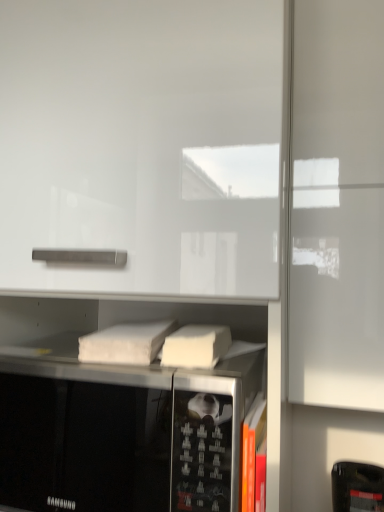
Image resolution: width=384 pixels, height=512 pixels. Find the location of `black matte microwave oven at center`. black matte microwave oven at center is located at coordinates (84, 438).

Who is smaller, black matte microwave oven at center or white matte book at center, marked as the 1th book in a back-to-front arrangement?

white matte book at center, marked as the 1th book in a back-to-front arrangement.

From a real-world perspective, does black matte microwave oven at center stand above white matte book at center, which is counted as the 1th book, starting from the left?

No, from a real-world perspective, black matte microwave oven at center is not over white matte book at center, which is counted as the 1th book, starting from the left

Which object is more forward, black matte microwave oven at center or white matte book at center, the second book from the bottom?

Positioned in front is black matte microwave oven at center.

From the image's perspective, between black matte microwave oven at center and white matte book at center, arranged as the 1th book when viewed from the top, which one is located above?

white matte book at center, arranged as the 1th book when viewed from the top, is shown above in the image.

Are black matte microwave oven at center and orange matte book at lower right, which ranks as the first book in right-to-left order, beside each other?

No, black matte microwave oven at center is not next to orange matte book at lower right, which ranks as the first book in right-to-left order.

Does black matte microwave oven at center contain orange matte book at lower right, the first book in the bottom-to-top sequence?

No, orange matte book at lower right, the first book in the bottom-to-top sequence, is not surrounded by black matte microwave oven at center.

Is black matte microwave oven at center positioned with its back to orange matte book at lower right, which ranks as the first book in right-to-left order?

No, black matte microwave oven at center is not facing away from orange matte book at lower right, which ranks as the first book in right-to-left order.

Considering the positions of objects black matte microwave oven at center and orange matte book at lower right, which ranks as the first book in right-to-left order, in the image provided, who is in front, black matte microwave oven at center or orange matte book at lower right, which ranks as the first book in right-to-left order,?

black matte microwave oven at center is more forward.

Which of these two, white matte book at center, marked as the 1th book in a back-to-front arrangement, or black matte microwave oven at center, is thinner?

Thinner between the two is white matte book at center, marked as the 1th book in a back-to-front arrangement.

Would you say white matte book at center, the second book from the bottom, is inside or outside black matte microwave oven at center?

white matte book at center, the second book from the bottom, lies outside black matte microwave oven at center.

Does white matte book at center, arranged as the 1th book when viewed from the top, have a greater height compared to black matte microwave oven at center?

In fact, white matte book at center, arranged as the 1th book when viewed from the top, may be shorter than black matte microwave oven at center.

Who is bigger, white matte book at center, which is the 2th book from right to left, or black matte microwave oven at center?

Bigger between the two is black matte microwave oven at center.

Is orange matte book at lower right, which is the 1th book from front to back, with black matte microwave oven at center?

No, orange matte book at lower right, which is the 1th book from front to back, is not in contact with black matte microwave oven at center.

Locate an element on the screen. book below the black matte microwave oven at center (from the image's perspective) is located at coordinates (252, 449).

Consider the image. Does orange matte book at lower right, which ranks as the first book in right-to-left order, have a larger size compared to black matte microwave oven at center?

No.

Can you confirm if white matte book at center, which is the 2th book from right to left, is bigger than orange matte book at lower right, which is the second book in back-to-front order?

Correct, white matte book at center, which is the 2th book from right to left, is larger in size than orange matte book at lower right, which is the second book in back-to-front order.

From the image's perspective, which is below, white matte book at center, marked as the 1th book in a back-to-front arrangement, or orange matte book at lower right, the first book in the bottom-to-top sequence?

orange matte book at lower right, the first book in the bottom-to-top sequence, from the image's perspective.

Are white matte book at center, which is counted as the 1th book, starting from the left, and orange matte book at lower right, which is the second book in back-to-front order, far apart?

Actually, white matte book at center, which is counted as the 1th book, starting from the left, and orange matte book at lower right, which is the second book in back-to-front order, are a little close together.

From the picture: Can orange matte book at lower right, placed as the 2th book when sorted from top to bottom, be found inside white matte book at center, the second book from the bottom?

No, orange matte book at lower right, placed as the 2th book when sorted from top to bottom, is located outside of white matte book at center, the second book from the bottom.

Between orange matte book at lower right, which is the second book in back-to-front order, and white matte book at center, which is the 2th book from right to left, which one has more height?

orange matte book at lower right, which is the second book in back-to-front order.

Does orange matte book at lower right, which is the 1th book from front to back, have a greater width compared to white matte book at center, the second book from the bottom?

Incorrect, the width of orange matte book at lower right, which is the 1th book from front to back, does not surpass that of white matte book at center, the second book from the bottom.

In the image, there is a white matte book at center, the second book from the bottom. What are the coordinates of `book below it (from a real-world perspective)` in the screenshot? It's located at (252, 449).

Looking at this image, is orange matte book at lower right, which is the second book in back-to-front order, next to white matte book at center, the second book from the front, and touching it?

No, orange matte book at lower right, which is the second book in back-to-front order, is not next to white matte book at center, the second book from the front.

Find the location of `book positioned vertically above the black matte microwave oven at center (from a real-world perspective)`. book positioned vertically above the black matte microwave oven at center (from a real-world perspective) is located at coordinates (125, 343).

Locate an element on the screen. microwave oven located in front of the orange matte book at lower right, which is the 1th book from front to back is located at coordinates (84, 438).

Looking at the image, which one is located closer to black matte microwave oven at center, white matte book at center, marked as the 1th book in a back-to-front arrangement, or orange matte book at lower right, which ranks as the first book in right-to-left order?

white matte book at center, marked as the 1th book in a back-to-front arrangement, lies closer to black matte microwave oven at center than the other object.

Looking at the image, which one is located further to orange matte book at lower right, which is the 1th book from front to back, white matte book at center, marked as the 1th book in a back-to-front arrangement, or black matte microwave oven at center?

Among the two, white matte book at center, marked as the 1th book in a back-to-front arrangement, is located further to orange matte book at lower right, which is the 1th book from front to back.

Based on their spatial positions, is black matte microwave oven at center or white matte book at center, the second book from the bottom, closer to orange matte book at lower right, which ranks as the second book in left-to-right order?

black matte microwave oven at center is positioned closer to the anchor orange matte book at lower right, which ranks as the second book in left-to-right order.

Looking at this image, based on their spatial positions, is orange matte book at lower right, the first book in the bottom-to-top sequence, or black matte microwave oven at center closer to white matte book at center, arranged as the 1th book when viewed from the top?

black matte microwave oven at center.

Considering their positions, is black matte microwave oven at center positioned further to white matte book at center, the second book from the bottom, than orange matte book at lower right, which ranks as the second book in left-to-right order?

orange matte book at lower right, which ranks as the second book in left-to-right order, is positioned further to the anchor white matte book at center, the second book from the bottom.

Estimate the real-world distances between objects in this image. Which object is closer to black matte microwave oven at center, orange matte book at lower right, which is the second book in back-to-front order, or white matte book at center, the second book from the bottom?

white matte book at center, the second book from the bottom, is positioned closer to the anchor black matte microwave oven at center.

Locate an element on the screen. The width and height of the screenshot is (384, 512). book between black matte microwave oven at center and orange matte book at lower right, which ranks as the first book in right-to-left order is located at coordinates (125, 343).